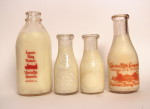
At what (x,y) coordinates should I click in order to perform the action: click on gray shadow under bottle. Please return your answer as a coordinate pair (x, y). The width and height of the screenshot is (150, 109). Looking at the image, I should click on (62, 93).